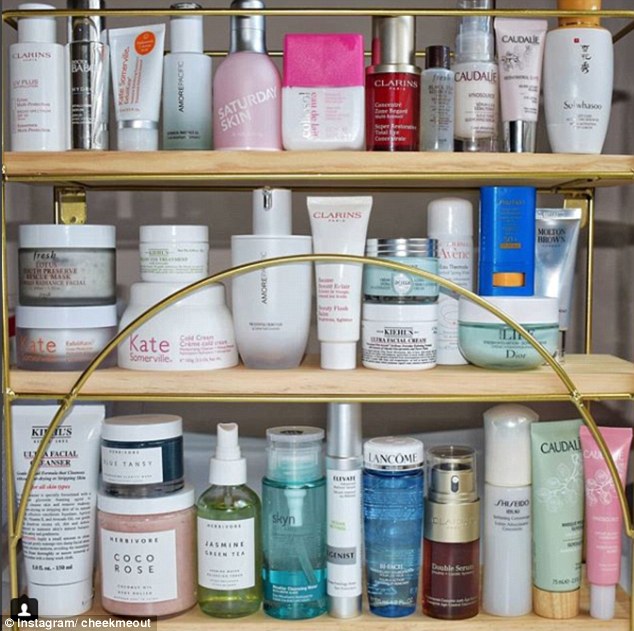
Where is `brass horizonal bar above top shelf`? Image resolution: width=634 pixels, height=631 pixels. brass horizonal bar above top shelf is located at coordinates (44, 12), (610, 15).